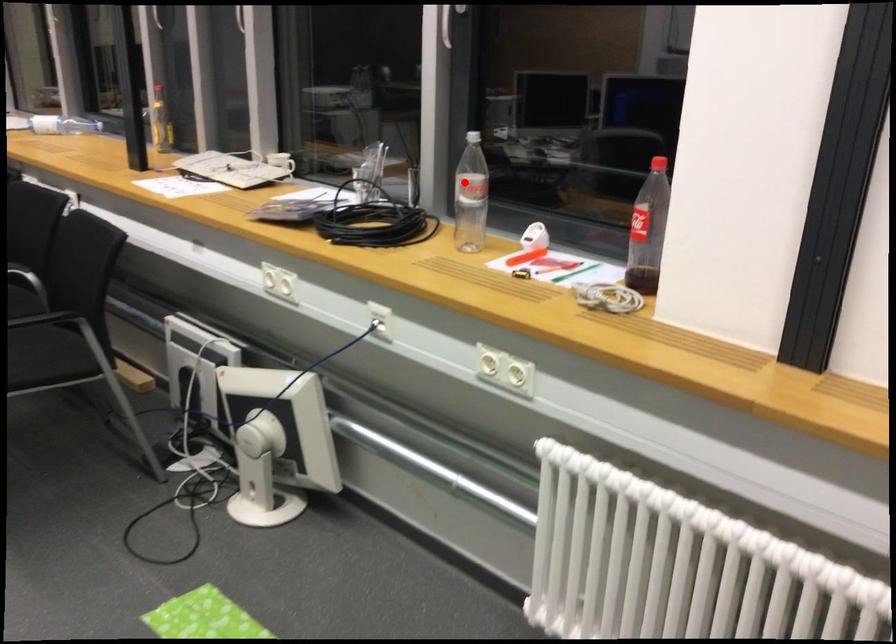
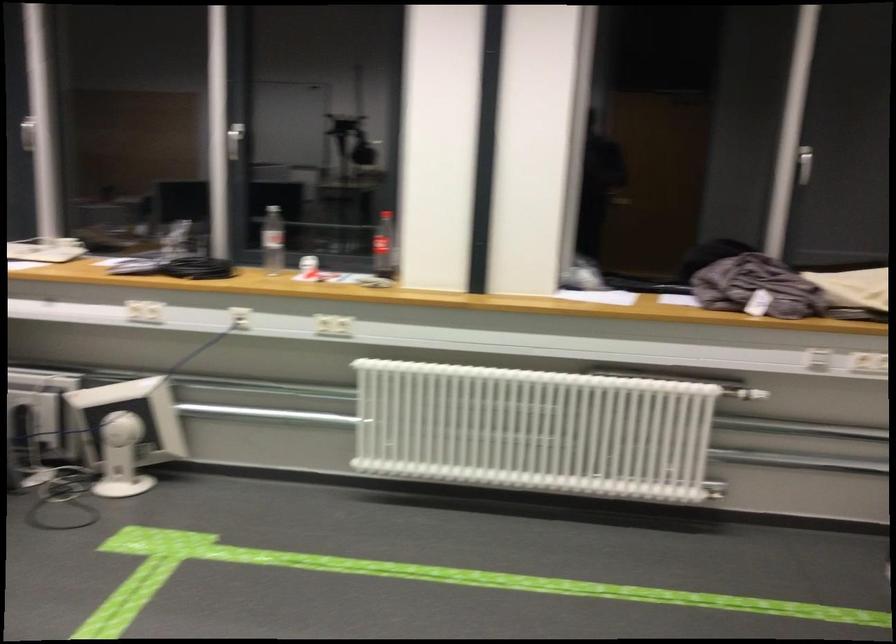
Question: I am providing you with two images of the same scene from different viewpoints. A red point is shown in image1. For the corresponding object point in image2, is it positioned nearer or farther from the camera?

Choices:
 (A) Nearer
 (B) Farther

Answer: (B)